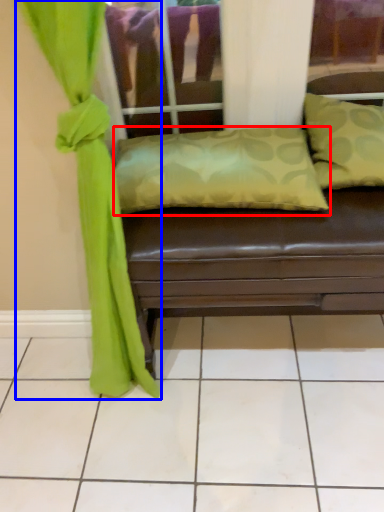
Question: Which object is closer to the camera taking this photo, pillow (highlighted by a red box) or curtain (highlighted by a blue box)?

Choices:
 (A) pillow
 (B) curtain

Answer: (B)